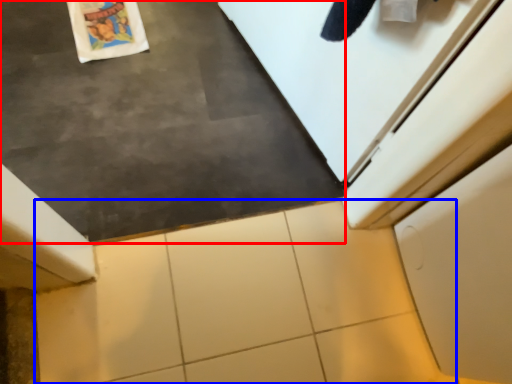
Question: Which object is further to the camera taking this photo, slate (highlighted by a red box) or tile (highlighted by a blue box)?

Choices:
 (A) slate
 (B) tile

Answer: (B)